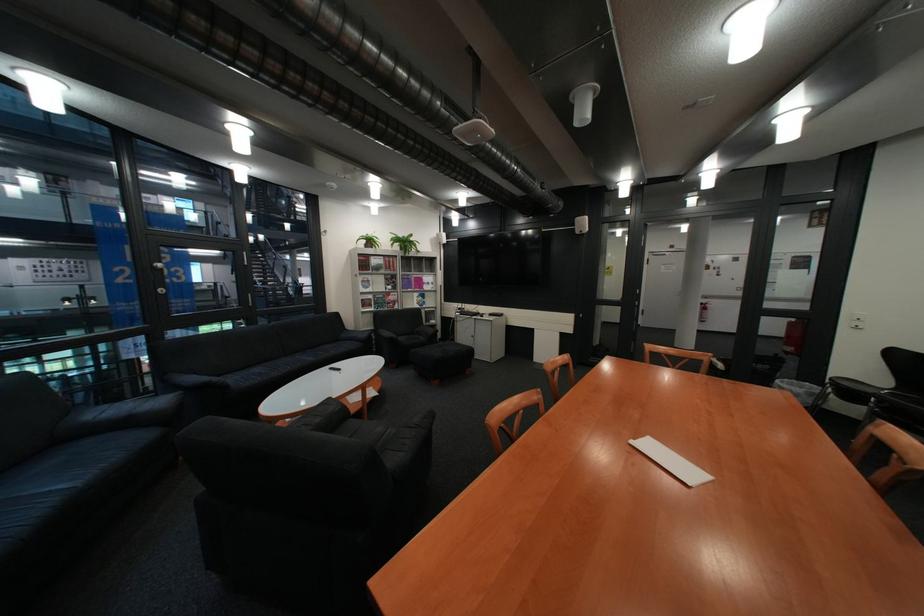
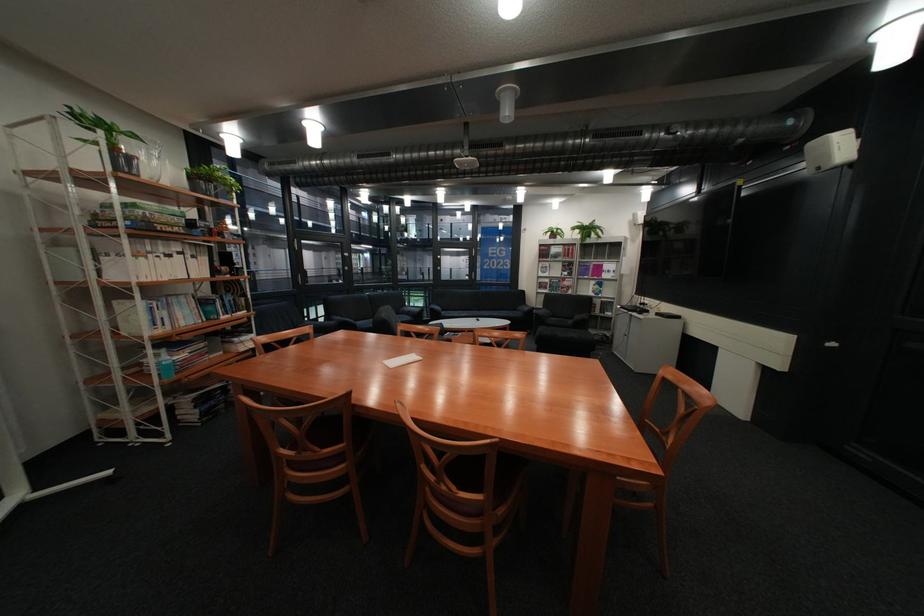
In the second image, find the point that corresponds to point 354,341 in the first image.

(531, 310)